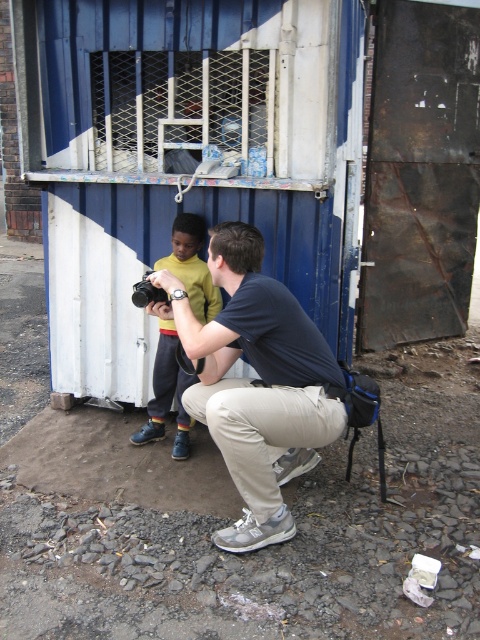
You are standing at the point labeled point (237, 22) and want to walk to the point labeled point (133, 298). Which direction should you move to get closer to your destination?

You should move forward because point (237, 22) is behind point (133, 298), so moving forward towards the direction of point (133, 298) will bring you closer.

You are trying to determine if the yellow cotton shirt at center can completely cover the black plastic camera at center when placed over it. Based on their sizes, is this possible?

The yellow cotton shirt at center might be wider than black plastic camera at center, so it could potentially cover it depending on the shirt size and how it is positioned.

You are the photographer holding the black plastic camera at center. You want to adjust your position so that the matte blue shirt at center is now farther away from you. Which direction should you move?

The matte blue shirt at center is closer to the viewer than the black plastic camera at center. To make the matte blue shirt at center appear farther away, you should move backward away from the matte blue shirt at center.